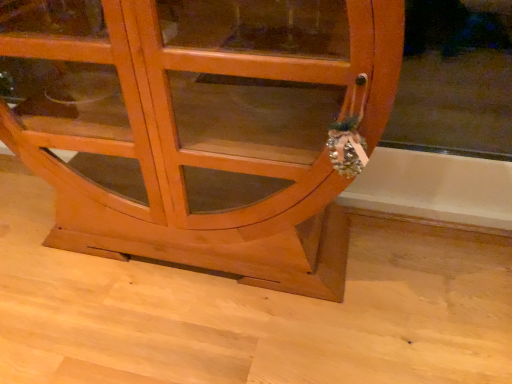
The height and width of the screenshot is (384, 512). What do you see at coordinates (209, 131) in the screenshot?
I see `matte wood cabinet at center` at bounding box center [209, 131].

The height and width of the screenshot is (384, 512). I want to click on matte wood cabinet at center, so click(209, 131).

Locate an element on the screen. This screenshot has height=384, width=512. matte wood cabinet at center is located at coordinates (209, 131).